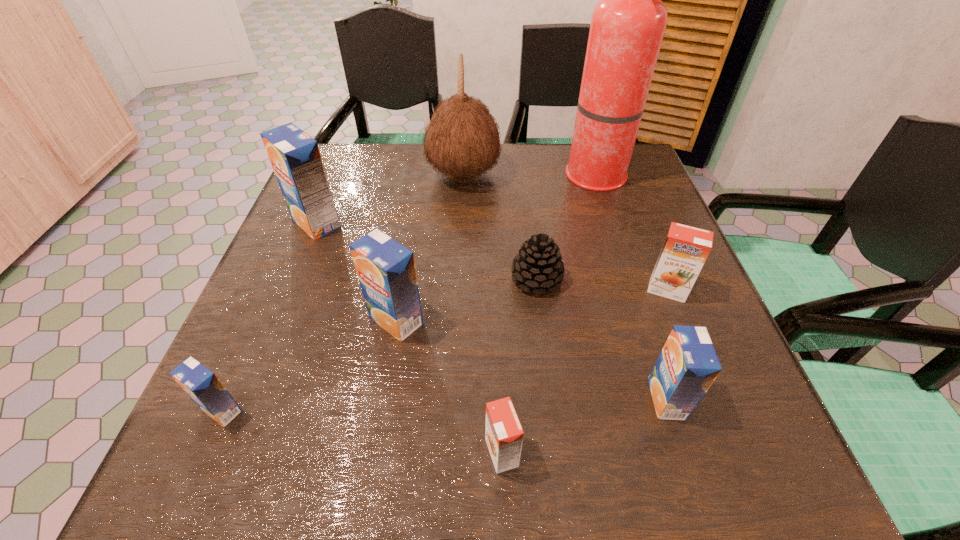
Identify which blue orange_juice is the closest to the bigger orange orange juice. Please provide its 2D coordinates. Your answer should be formatted as a tuple, i.e. [(x, y)], where the tuple contains the x and y coordinates of a point satisfying the conditions above.

[(687, 366)]

Locate an element on the screen. This screenshot has height=540, width=960. free location that satisfies the following two spatial constraints: 1. on the back side of the nearest object; 2. on the surface of the coconut is located at coordinates (492, 176).

The height and width of the screenshot is (540, 960). I want to click on free spot that satisfies the following two spatial constraints: 1. on the back side of the smallest blue orange_juice; 2. on the right side of the second orange juice from right to left, so click(228, 399).

The image size is (960, 540). I want to click on vacant space that satisfies the following two spatial constraints: 1. on the back side of the bigger orange orange juice; 2. with the handle and hose on the red fire extinguisher, so click(x=623, y=179).